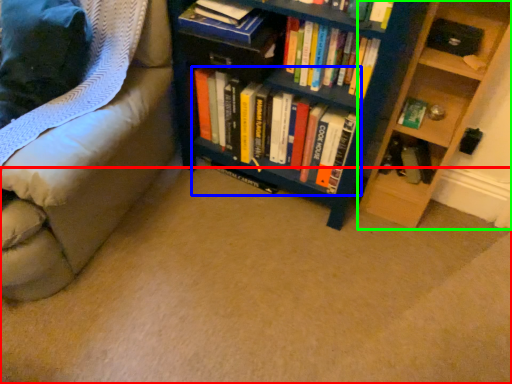
Question: Based on their relative distances, which object is nearer to plain (highlighted by a red box)? Choose from book (highlighted by a blue box) and shelf (highlighted by a green box).

Choices:
 (A) book
 (B) shelf

Answer: (A)